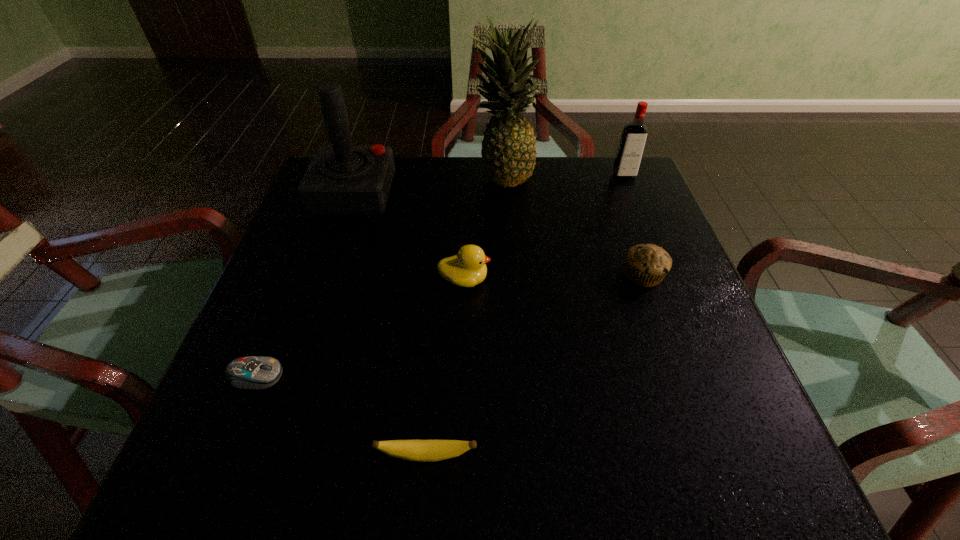
The width and height of the screenshot is (960, 540). In order to click on vacant space located 0.310m on the base of the joystick in this screenshot , I will do `click(516, 194)`.

Where is `vacant region located 0.130m on the front and back of the third tallest object`? Image resolution: width=960 pixels, height=540 pixels. vacant region located 0.130m on the front and back of the third tallest object is located at coordinates (638, 212).

Locate an element on the screen. The height and width of the screenshot is (540, 960). free point located on the beak of the fourth shortest object is located at coordinates (588, 280).

I want to click on free spot located 0.280m on the front of the fifth tallest object, so click(x=697, y=426).

Locate an element on the screen. vacant space located on the back of the second shortest object is located at coordinates (429, 415).

Locate an element on the screen. The height and width of the screenshot is (540, 960). free location located 0.380m on the wheel side of the computer mouse is located at coordinates (509, 376).

Image resolution: width=960 pixels, height=540 pixels. Identify the location of pineapple located in the far edge section of the desktop. (508, 152).

Where is `joystick at the far edge`? This screenshot has width=960, height=540. joystick at the far edge is located at coordinates click(x=342, y=179).

Find the location of a particular element. vodka positioned at the far edge is located at coordinates (633, 139).

Identify the location of object located at the near edge. (413, 450).